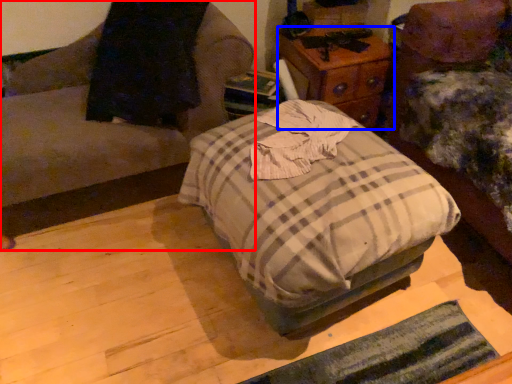
Question: Among these objects, which one is farthest to the camera, furniture (highlighted by a red box) or nightstand (highlighted by a blue box)?

Choices:
 (A) furniture
 (B) nightstand

Answer: (B)